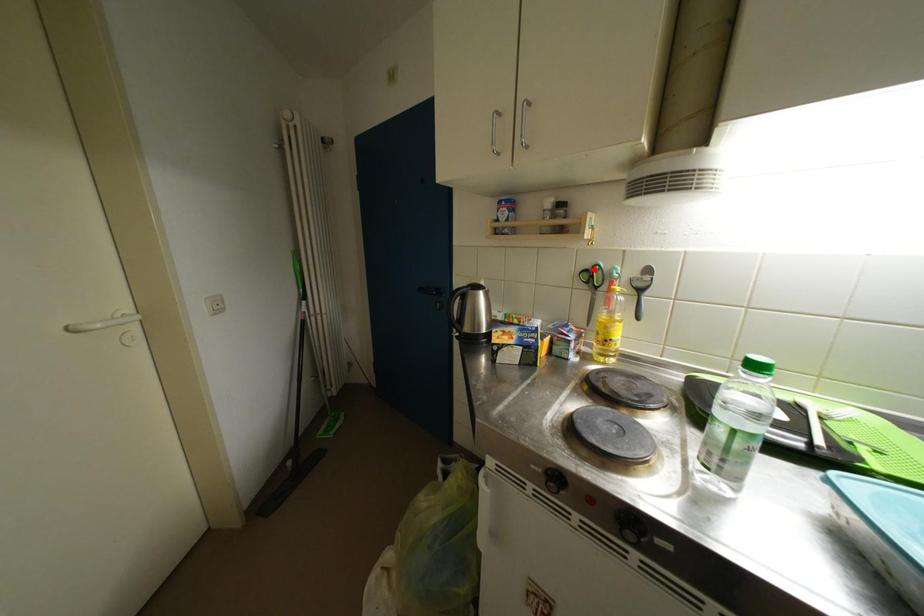
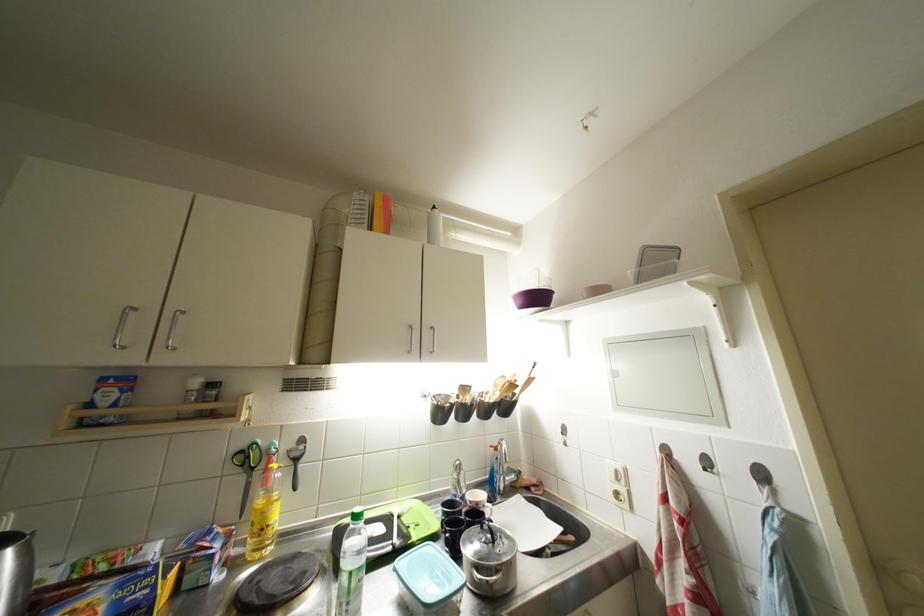
Locate, in the second image, the point that corresponds to the highlighted location in the first image.

(249, 450)